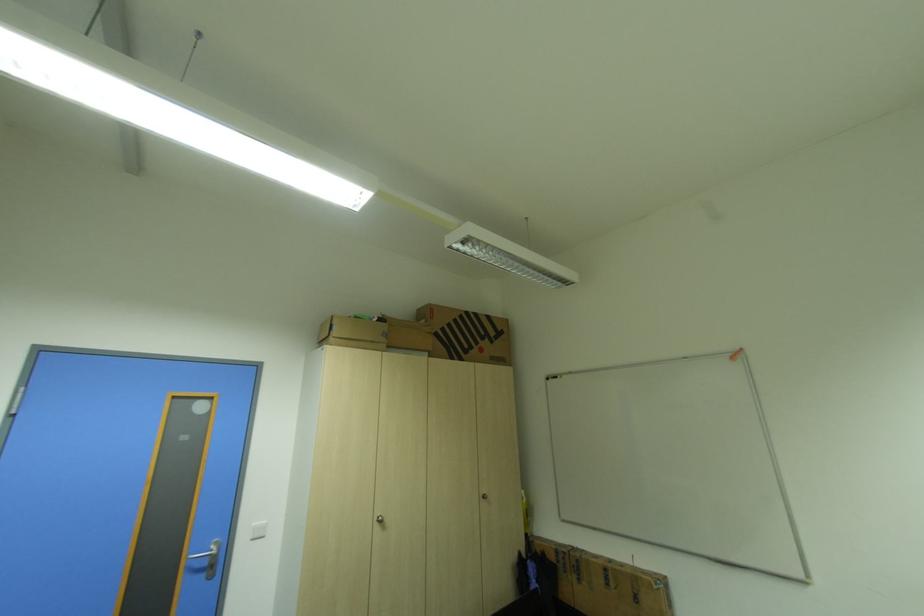
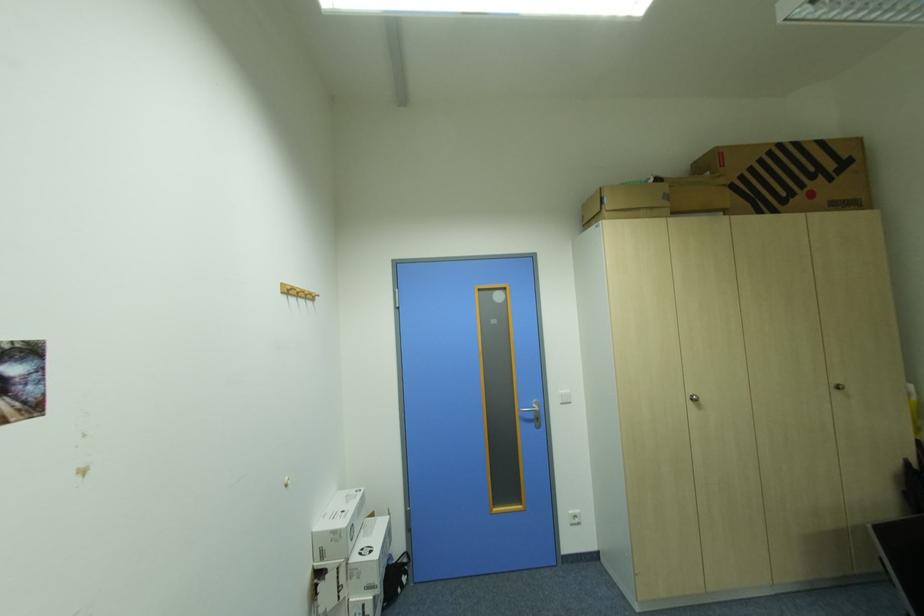
Find the pixel in the second image that matches the point at 383,520 in the first image.

(697, 399)